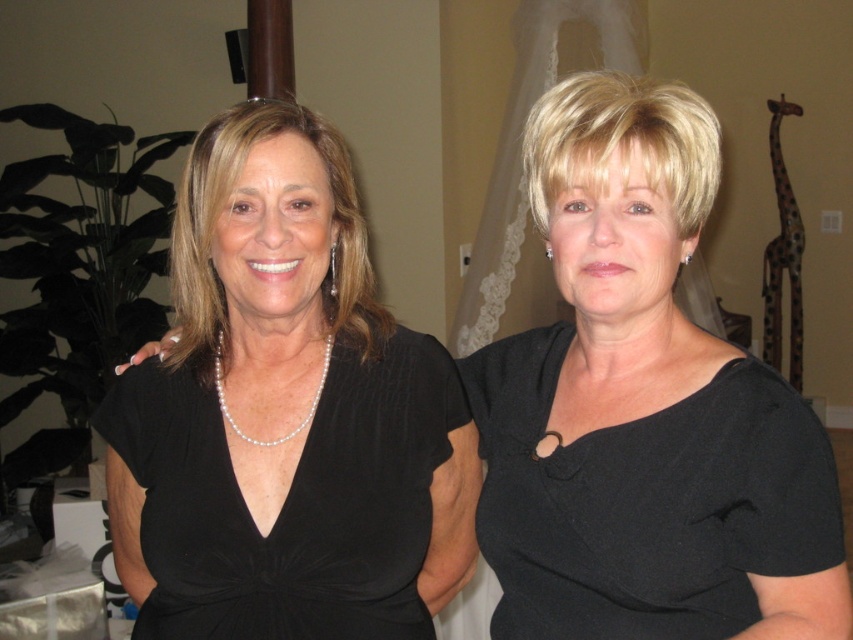
Question: Does black matte dress at center have a greater width compared to black satin dress at center?

Choices:
 (A) yes
 (B) no

Answer: (B)

Question: From the image, what is the correct spatial relationship of black matte dress at center in relation to black satin dress at center?

Choices:
 (A) above
 (B) below

Answer: (A)

Question: Does black matte dress at center have a greater width compared to black satin dress at center?

Choices:
 (A) no
 (B) yes

Answer: (A)